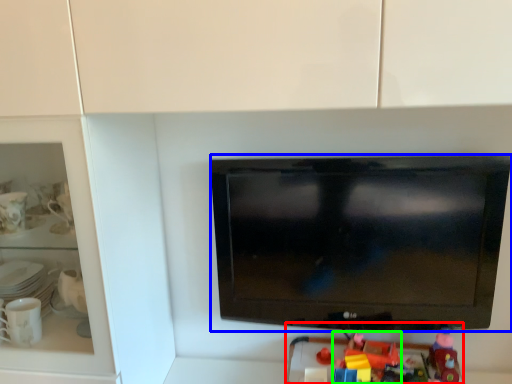
Question: Estimate the real-world distances between objects in this image. Which object is farther from toy (highlighted by a red box), television (highlighted by a blue box) or toy (highlighted by a green box)?

Choices:
 (A) television
 (B) toy

Answer: (A)